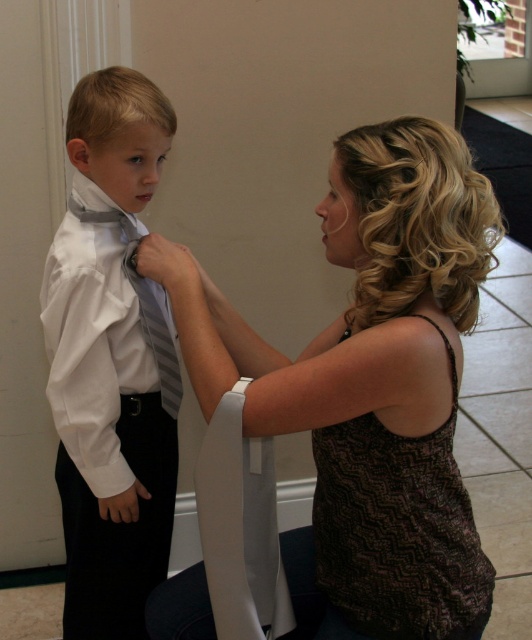
Is matte brown tank top at center above striped fabric tie at center?

No, matte brown tank top at center is not above striped fabric tie at center.

What are the coordinates of `matte brown tank top at center` in the screenshot? It's located at (369, 387).

Locate an element on the screen. matte brown tank top at center is located at coordinates (369, 387).

Is matte gray tie at left closer to the viewer compared to striped fabric tie at center?

That is True.

Who is positioned more to the left, matte gray tie at left or striped fabric tie at center?

Positioned to the left is matte gray tie at left.

Does point (80, 516) come farther from viewer compared to point (179, 394)?

No, it is not.

Identify the location of matte gray tie at left. (111, 360).

Can you confirm if matte gray tie at left is thinner than brown zigzag-patterned tank top at center?

Yes, matte gray tie at left is thinner than brown zigzag-patterned tank top at center.

Is matte gray tie at left to the left of brown zigzag-patterned tank top at center from the viewer's perspective?

Yes, matte gray tie at left is to the left of brown zigzag-patterned tank top at center.

Who is more distant from viewer, [123,243] or [444,516]?

The point [123,243] is more distant.

Where is `matte gray tie at left`? This screenshot has height=640, width=532. matte gray tie at left is located at coordinates (111, 360).